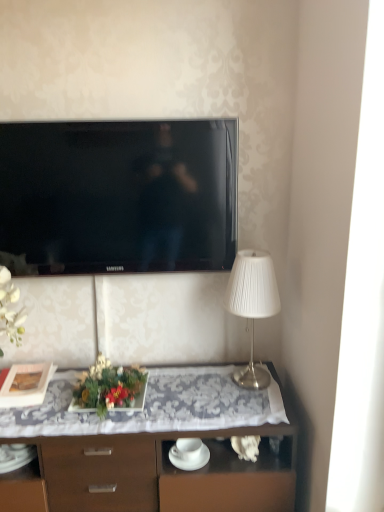
Locate an element on the screen. The width and height of the screenshot is (384, 512). vacant space underneath white pleated fabric lampshade at right (from a real-world perspective) is located at coordinates (249, 379).